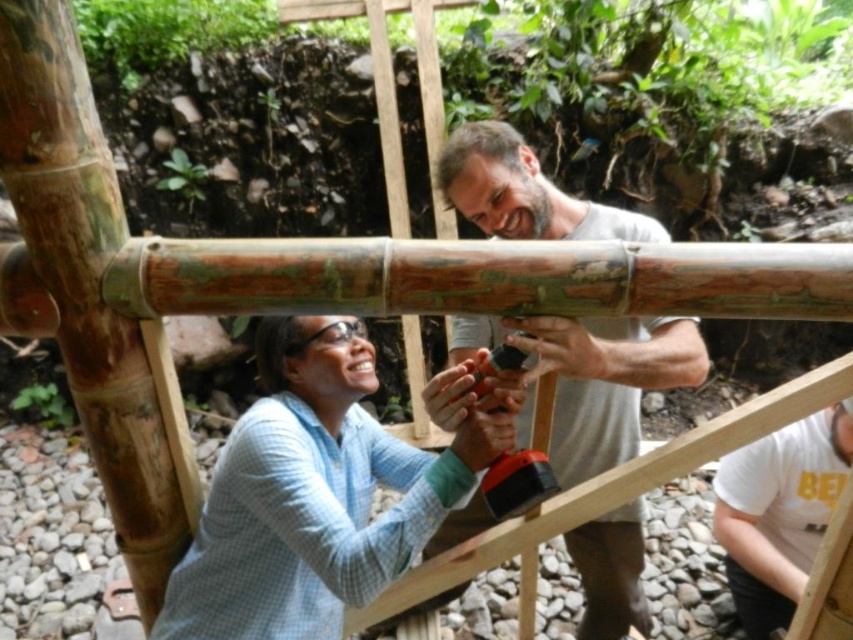
You are a GUI agent. You are given a task and a screenshot of the screen. Output one action in this format:
    pyautogui.click(x=<x>, y=<y>)
    Task: Click on the light blue checkered shirt at center
    
    Given the screenshot: What is the action you would take?
    pyautogui.click(x=314, y=493)

Who is higher up, light blue checkered shirt at center or smooth gray shirt at center?

light blue checkered shirt at center is above.

Image resolution: width=853 pixels, height=640 pixels. What do you see at coordinates (314, 493) in the screenshot?
I see `light blue checkered shirt at center` at bounding box center [314, 493].

Image resolution: width=853 pixels, height=640 pixels. Find the location of `light blue checkered shirt at center`. light blue checkered shirt at center is located at coordinates (314, 493).